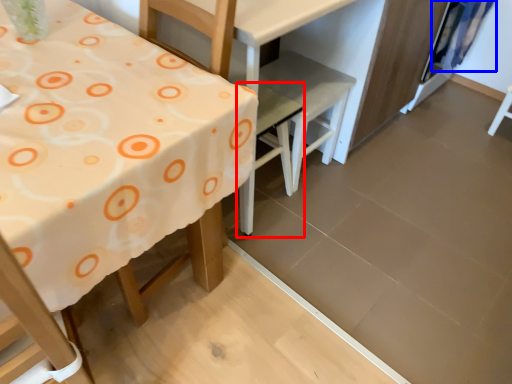
Question: Which of the following is the closest to the observer, chair (highlighted by a red box) or curtain (highlighted by a blue box)?

Choices:
 (A) chair
 (B) curtain

Answer: (A)